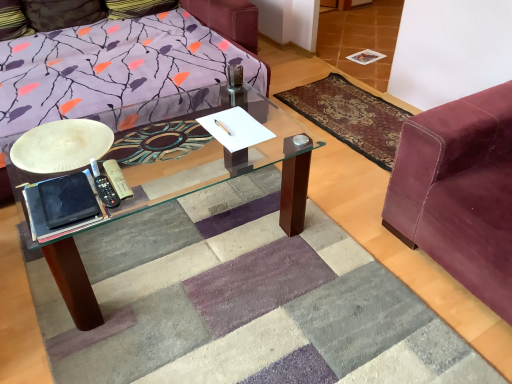
Where is `vacant region to the left of velvet maroon couch at right`? The height and width of the screenshot is (384, 512). vacant region to the left of velvet maroon couch at right is located at coordinates (339, 263).